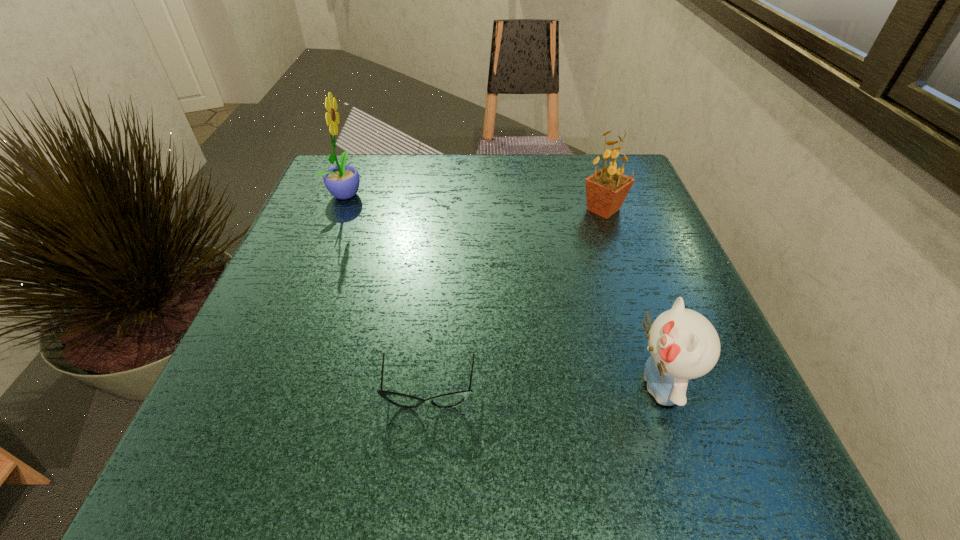
Where is `free space between the third tallest object and the leftmost object`? The height and width of the screenshot is (540, 960). free space between the third tallest object and the leftmost object is located at coordinates (503, 289).

What are the coordinates of `empty space that is in between the leftmost object and the kitten` in the screenshot? It's located at (503, 289).

Where is `free space that is in between the shorter sunflower and the third tallest object`? The height and width of the screenshot is (540, 960). free space that is in between the shorter sunflower and the third tallest object is located at coordinates (632, 298).

You are a GUI agent. You are given a task and a screenshot of the screen. Output one action in this format:
    pyautogui.click(x=<x>, y=<y>)
    Task: Click on the vacant space in between the second shortest object and the spectacles
    This screenshot has width=960, height=540.
    Given the screenshot: What is the action you would take?
    pyautogui.click(x=544, y=388)

Locate which object ranks third in proximity to the third object from right to left. Please provide its 2D coordinates. Your answer should be formatted as a tuple, i.e. [(x, y)], where the tuple contains the x and y coordinates of a point satisfying the conditions above.

[(342, 181)]

You are a GUI agent. You are given a task and a screenshot of the screen. Output one action in this format:
    pyautogui.click(x=<x>, y=<y>)
    Task: Click on the object that is the second closest one to the kitten
    
    Given the screenshot: What is the action you would take?
    pyautogui.click(x=606, y=190)

Locate an element on the screen. vacant region that satisfies the following two spatial constraints: 1. on the front-facing side of the third tallest object; 2. on the front-facing side of the spectacles is located at coordinates (660, 391).

Locate an element on the screen. vacant region that satisfies the following two spatial constraints: 1. at the front of the shorter sunflower with flowers visible; 2. on the front-facing side of the spectacles is located at coordinates (665, 391).

Where is `vacant space that satisfies the following two spatial constraints: 1. on the front-facing side of the second shortest object; 2. on the front-facing side of the shortest object`? Image resolution: width=960 pixels, height=540 pixels. vacant space that satisfies the following two spatial constraints: 1. on the front-facing side of the second shortest object; 2. on the front-facing side of the shortest object is located at coordinates (660, 391).

What are the coordinates of `free spot that satisfies the following two spatial constraints: 1. at the front of the right sunflower with flowers visible; 2. on the front-facing side of the second object from left to right` in the screenshot? It's located at (665, 391).